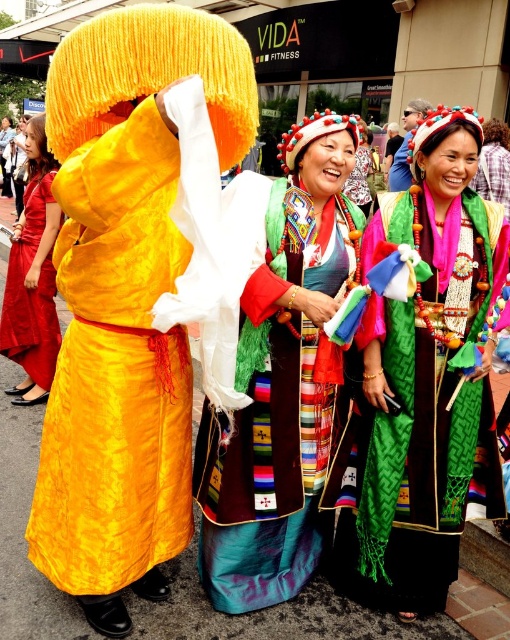
You are a photographer standing in the middle of the street, and you want to take a photo of both the embroidered silk dress at center and the matte red dress at left. Can you capture both in a single frame without moving your camera? The camera has a 60 degree field of view.

The embroidered silk dress at center and the matte red dress at left are 7.84 feet apart from each other. To determine if they can fit in a 60 degree field of view, we need to calculate the distance between them relative to the camera. However, the exact distance from the camera to the dresses isn not provided. Assuming the photographer is positioned equidistant from both dresses, the angular width required to frame both would depend on their distance from the camera. Without knowing the distance, it is not

Looking at this image, you are a photographer standing in the street scene and want to capture a closeup shot of the green woven scarf at center. Considering your camera has a minimum focusing distance of 2 meters, will you be able to take the photo without moving closer?

The green woven scarf at center is 2.31 meters away from the viewer. Since the camera can focus as close as 2 meters, you can take the closeup shot without moving closer because the distance is within the camera